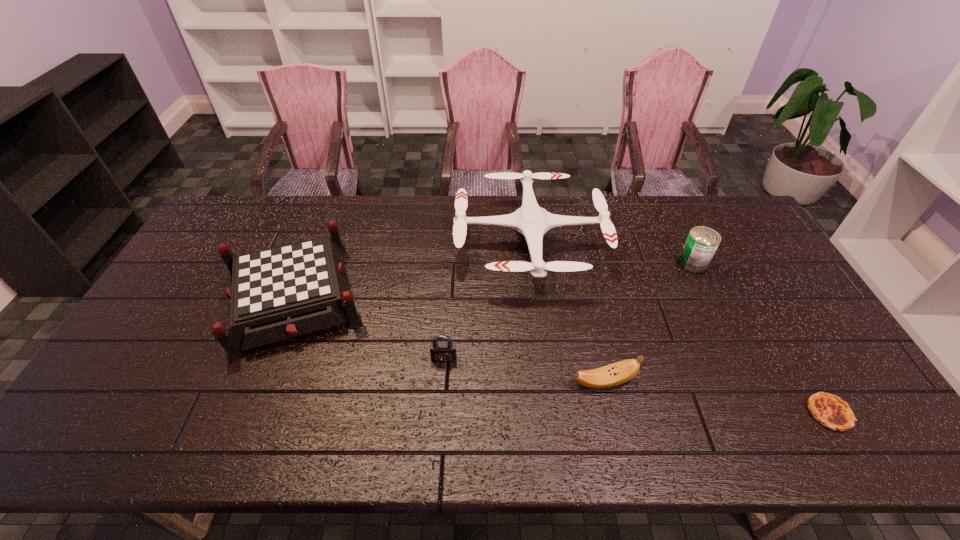
Identify the location of free spot between the nearest object and the fifth farthest object. (716, 397).

I want to click on free space between the nearest object and the second object from right to left, so click(760, 339).

This screenshot has width=960, height=540. Find the location of `vacant area between the padlock and the can`. vacant area between the padlock and the can is located at coordinates (568, 310).

Image resolution: width=960 pixels, height=540 pixels. I want to click on the fifth closest object to the leftmost object, so click(829, 410).

Where is `object that stands as the third closest to the drone`? The image size is (960, 540). object that stands as the third closest to the drone is located at coordinates (278, 293).

Where is `vacant area that satisfies the following two spatial constraints: 1. with the camera attached at the bottom of the drone; 2. on the right side of the second nearest object`? Image resolution: width=960 pixels, height=540 pixels. vacant area that satisfies the following two spatial constraints: 1. with the camera attached at the bottom of the drone; 2. on the right side of the second nearest object is located at coordinates (546, 382).

What are the coordinates of `free location that satisfies the following two spatial constraints: 1. on the front of the padlock near the keyhole; 2. on the right side of the banana` in the screenshot? It's located at (443, 382).

Where is `free location that satisfies the following two spatial constraints: 1. on the back side of the checkerboard; 2. on the right side of the can`? free location that satisfies the following two spatial constraints: 1. on the back side of the checkerboard; 2. on the right side of the can is located at coordinates (307, 264).

Image resolution: width=960 pixels, height=540 pixels. I want to click on free space that satisfies the following two spatial constraints: 1. with the camera attached at the bottom of the fifth object from left to right; 2. on the right side of the drone, so click(x=532, y=264).

The width and height of the screenshot is (960, 540). What are the coordinates of `free region that satisfies the following two spatial constraints: 1. with the camera attached at the bottom of the drone; 2. on the right side of the can` in the screenshot? It's located at (532, 264).